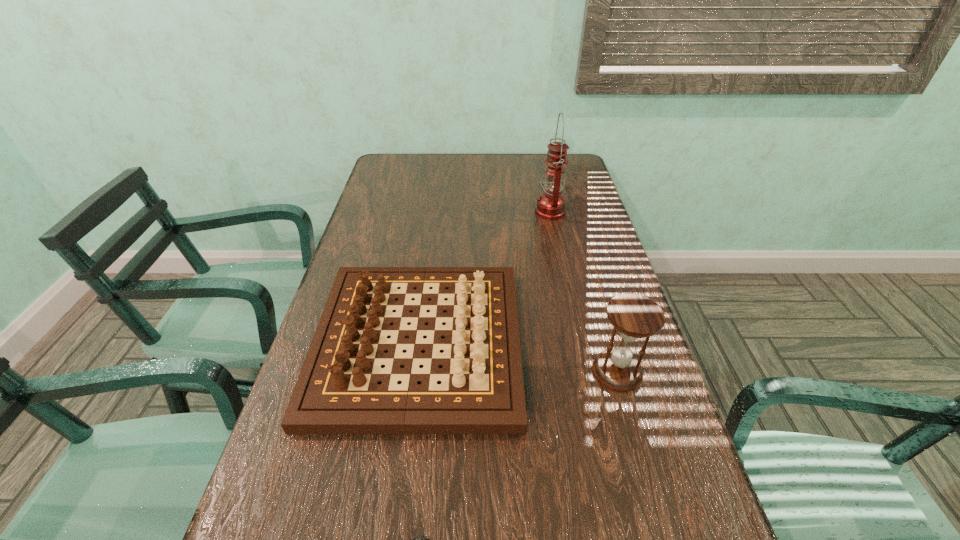
The height and width of the screenshot is (540, 960). I want to click on the tallest object, so click(551, 204).

This screenshot has width=960, height=540. In order to click on the farthest object in this screenshot , I will do `click(551, 204)`.

The width and height of the screenshot is (960, 540). In order to click on the second tallest object in this screenshot , I will do `click(634, 316)`.

Where is `the second shortest object`? the second shortest object is located at coordinates (482, 391).

Image resolution: width=960 pixels, height=540 pixels. What are the coordinates of `blank space located 0.080m on the front of the farthest object` in the screenshot? It's located at (556, 239).

Identify the location of free space located on the front of the hourglass. (661, 527).

This screenshot has height=540, width=960. Find the location of `vacant space located on the side with the white pieces of the gameboard`. vacant space located on the side with the white pieces of the gameboard is located at coordinates (638, 342).

Image resolution: width=960 pixels, height=540 pixels. What are the coordinates of `object that is at the left edge` in the screenshot? It's located at (482, 391).

Image resolution: width=960 pixels, height=540 pixels. I want to click on oil lamp at the right edge, so click(x=551, y=204).

Locate an element on the screen. The width and height of the screenshot is (960, 540). hourglass situated at the right edge is located at coordinates (634, 316).